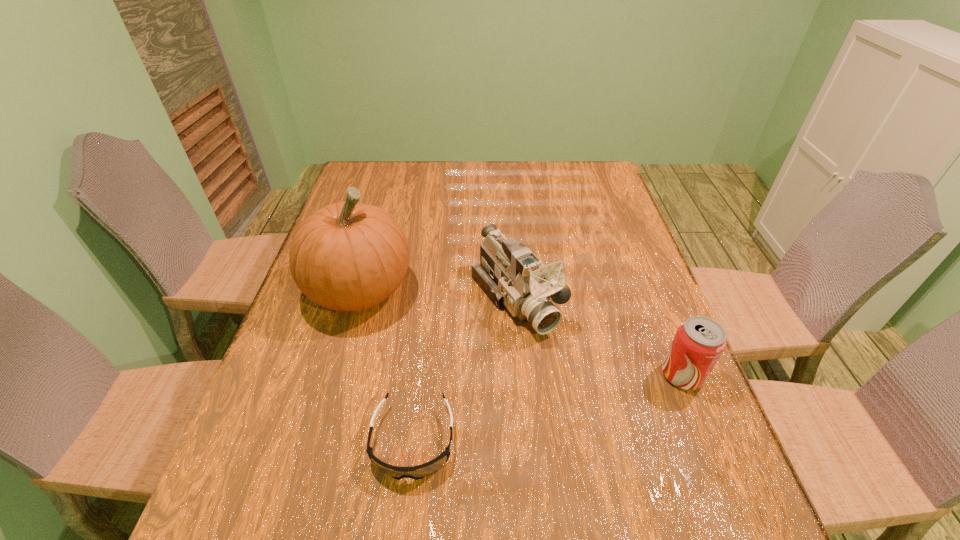
Where is `free spot on the desktop that is between the goggles and the third farthest object and is positioned on the front-facing side of the second tallest object`? This screenshot has height=540, width=960. free spot on the desktop that is between the goggles and the third farthest object and is positioned on the front-facing side of the second tallest object is located at coordinates (594, 396).

This screenshot has width=960, height=540. I want to click on vacant spot on the desktop that is between the shortest object and the third farthest object and is positioned on the stem of the tallest object, so click(x=591, y=397).